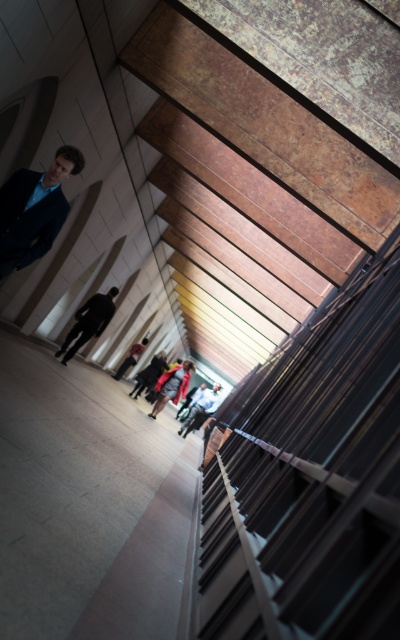
Question: Which of the following is the farthest from the observer?

Choices:
 (A) (84, 342)
 (B) (46, 248)

Answer: (A)

Question: Based on their relative distances, which object is nearer to the red leather jacket at center?

Choices:
 (A) dark gray suit at center
 (B) red fabric jacket at center
 (C) metallic gray staircase at right
 (D) white fabric jacket at center

Answer: (B)

Question: Is matte blue suit at upper left thinner than white fabric jacket at center?

Choices:
 (A) no
 (B) yes

Answer: (B)

Question: Which point is closer to the camera?

Choices:
 (A) (302, 452)
 (B) (146, 339)

Answer: (A)

Question: Observing the image, what is the correct spatial positioning of red fabric jacket at center in reference to red leather jacket at center?

Choices:
 (A) below
 (B) above

Answer: (A)

Question: Is dark gray suit at center wider than red fabric jacket at center?

Choices:
 (A) no
 (B) yes

Answer: (A)